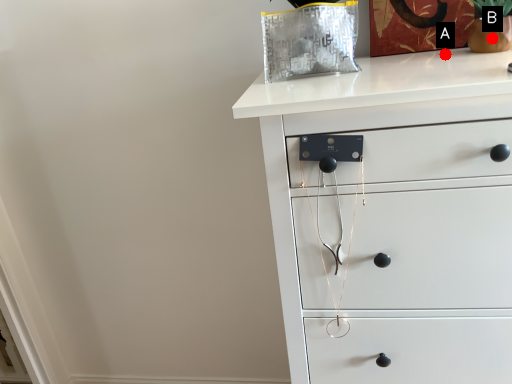
Question: Two points are circled on the image, labeled by A and B beside each circle. Which of the following is the closest to the observer?

Choices:
 (A) A is closer
 (B) B is closer

Answer: (B)